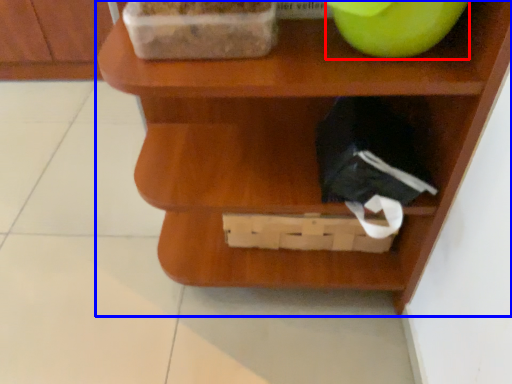
Question: Which point is further to the camera, apple (highlighted by a red box) or shelf (highlighted by a blue box)?

Choices:
 (A) apple
 (B) shelf

Answer: (A)